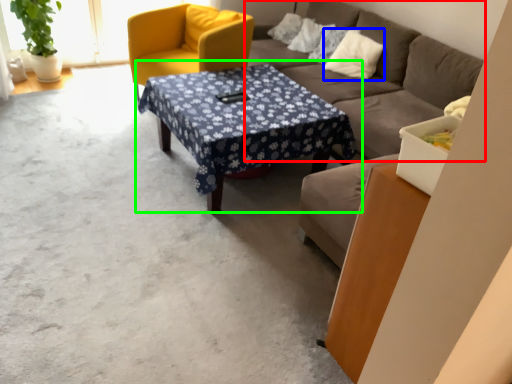
Question: Based on their relative distances, which object is farther from studio couch (highlighted by a red box)? Choose from pillow (highlighted by a blue box) and coffee table (highlighted by a green box).

Choices:
 (A) pillow
 (B) coffee table

Answer: (B)